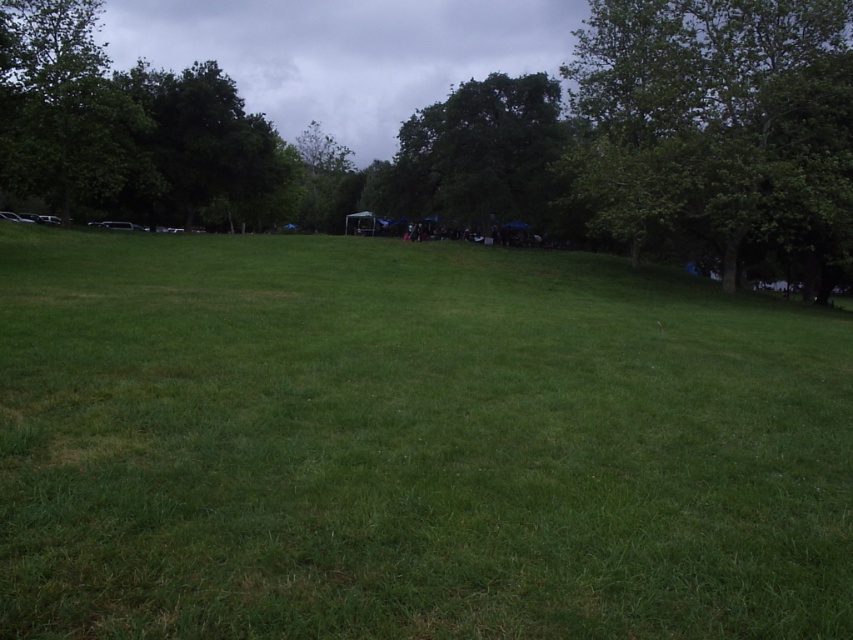
Question: Which point is farther to the camera?

Choices:
 (A) (805, 74)
 (B) (74, 163)

Answer: (B)

Question: Estimate the real-world distances between objects in this image. Which object is farther from the green leafy tree at center?

Choices:
 (A) green grass at center
 (B) green leafy tree at upper right

Answer: (A)

Question: Does green grass at center appear under green leafy tree at upper right?

Choices:
 (A) yes
 (B) no

Answer: (A)

Question: Does green grass at center have a lesser width compared to green leafy tree at upper right?

Choices:
 (A) yes
 (B) no

Answer: (B)

Question: Can you confirm if green grass at center is positioned to the left of green leafy tree at center?

Choices:
 (A) no
 (B) yes

Answer: (A)

Question: Which point is closer to the camera?

Choices:
 (A) (277, 612)
 (B) (42, 20)
 (C) (408, 131)

Answer: (A)